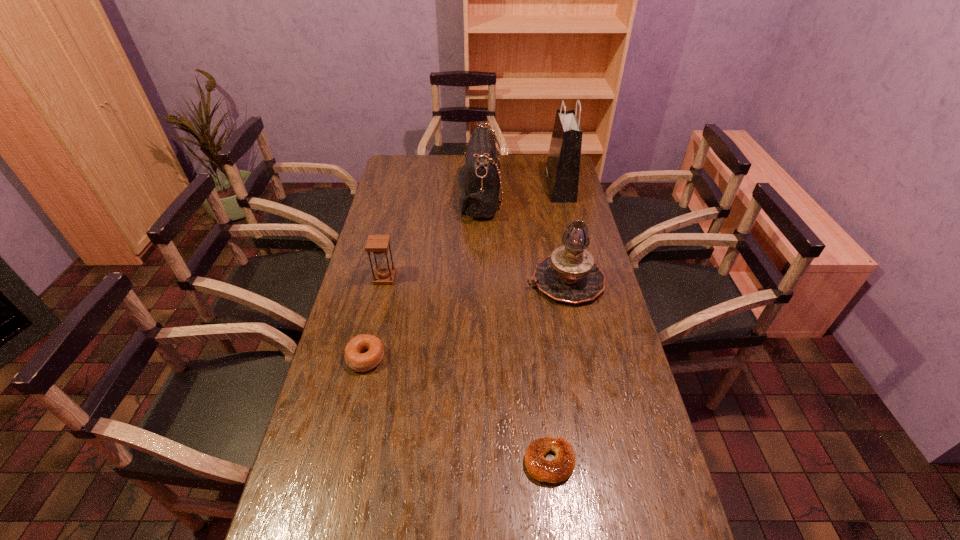
The width and height of the screenshot is (960, 540). Find the location of `shopping bag that is at the right edge`. shopping bag that is at the right edge is located at coordinates (562, 169).

Find the location of a particular element. oil lamp situated at the right edge is located at coordinates (569, 274).

Where is `object that is at the far right corner`? This screenshot has height=540, width=960. object that is at the far right corner is located at coordinates (562, 169).

What are the coordinates of `vacant space at the far edge of the desktop` in the screenshot? It's located at (460, 171).

What are the coordinates of `free location at the left edge of the desktop` in the screenshot? It's located at (407, 186).

Find the location of a particular element. This screenshot has height=540, width=960. vacant space at the right edge of the desktop is located at coordinates (620, 411).

The width and height of the screenshot is (960, 540). In the image, there is a desktop. Find the location of `vacant area at the far left corner`. vacant area at the far left corner is located at coordinates (388, 174).

Locate an element on the screen. This screenshot has height=540, width=960. free spot between the shortest object and the taller bagel is located at coordinates (458, 410).

This screenshot has width=960, height=540. In order to click on unoccupied position between the hourglass and the handbag in this screenshot , I will do click(x=432, y=238).

You are a GUI agent. You are given a task and a screenshot of the screen. Output one action in this format:
    pyautogui.click(x=<x>, y=<y>)
    Task: Click on the free space between the shortest object and the tallest object
    The width and height of the screenshot is (960, 540).
    Given the screenshot: What is the action you would take?
    pyautogui.click(x=555, y=325)